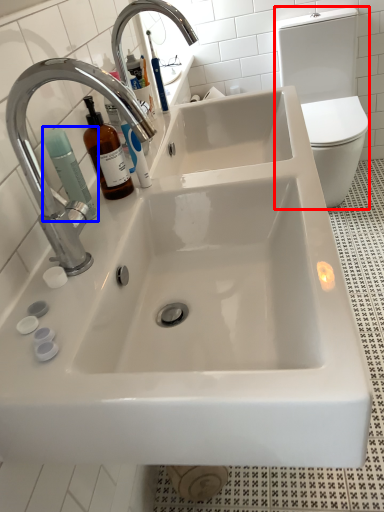
Question: Which object is further to the camera taking this photo, toilet bowl (highlighted by a red box) or cleaning product (highlighted by a blue box)?

Choices:
 (A) toilet bowl
 (B) cleaning product

Answer: (A)